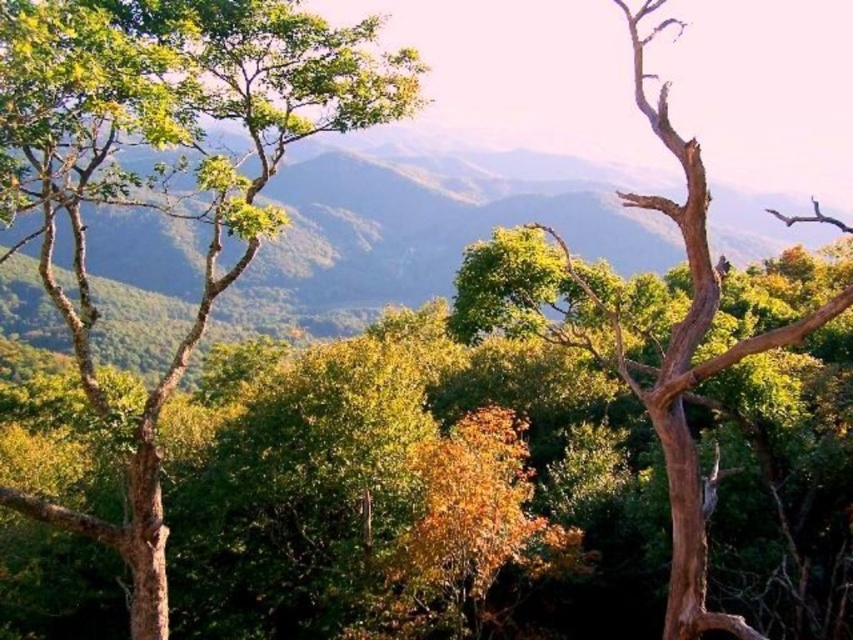
Question: Is green matte tree at left closer to the viewer compared to brown textured tree trunk at right?

Choices:
 (A) yes
 (B) no

Answer: (A)

Question: Does green matte tree at left have a greater width compared to green leafy trees at left?

Choices:
 (A) no
 (B) yes

Answer: (A)

Question: Which of these objects is positioned closest to the brown textured tree trunk at right?

Choices:
 (A) green matte tree at left
 (B) green leafy trees at left

Answer: (A)

Question: Which of the following is the closest to the observer?

Choices:
 (A) (358, 32)
 (B) (675, 454)
 (C) (367, 296)

Answer: (B)

Question: Is green leafy trees at left positioned before brown textured tree trunk at right?

Choices:
 (A) yes
 (B) no

Answer: (B)

Question: Estimate the real-world distances between objects in this image. Which object is farther from the brown textured tree trunk at right?

Choices:
 (A) green leafy trees at left
 (B) green matte tree at left

Answer: (A)